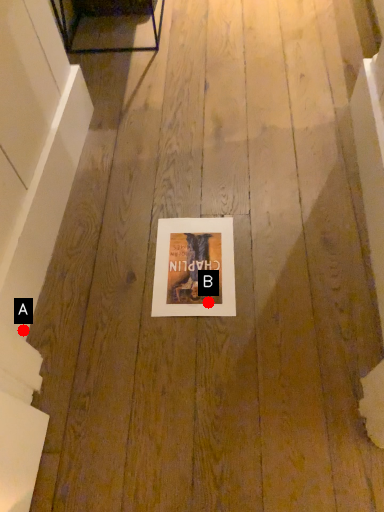
Question: Two points are circled on the image, labeled by A and B beside each circle. Which point is closer to the camera?

Choices:
 (A) A is closer
 (B) B is closer

Answer: (A)